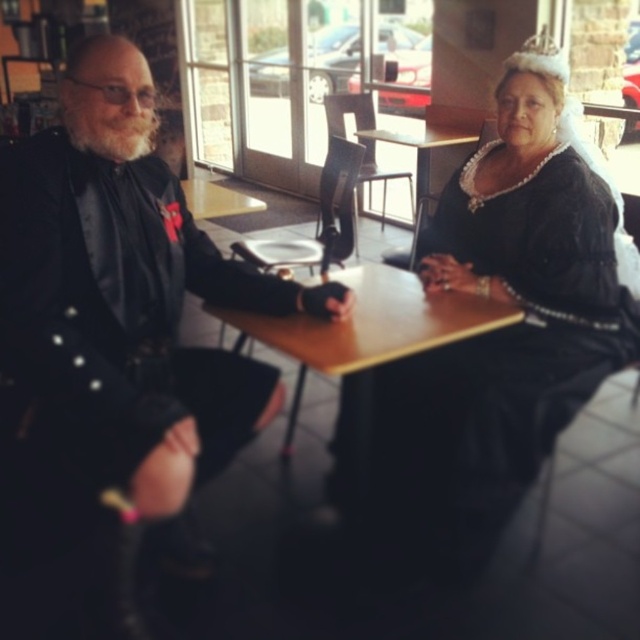
Find the location of a particular element. The width and height of the screenshot is (640, 640). black satin suit at left is located at coordinates (113, 356).

Who is positioned more to the left, black satin suit at left or black satin dress at center?

Positioned to the left is black satin suit at left.

Which is behind, point (198, 268) or point (410, 371)?

Point (410, 371)

You are a GUI agent. You are given a task and a screenshot of the screen. Output one action in this format:
    pyautogui.click(x=<x>, y=<y>)
    Task: Click on the black satin suit at left
    The width and height of the screenshot is (640, 640).
    Given the screenshot: What is the action you would take?
    pyautogui.click(x=113, y=356)

Who is positioned more to the right, black satin dress at center or wooden table at center?

black satin dress at center

Can you confirm if black satin dress at center is positioned above wooden table at center?

Actually, black satin dress at center is below wooden table at center.

Who is more distant from viewer, [442,465] or [426,330]?

Positioned behind is point [442,465].

Locate an element on the screen. The width and height of the screenshot is (640, 640). black satin dress at center is located at coordinates (506, 330).

Which is behind, point (76, 163) or point (352, 266)?

Point (352, 266)

Can you confirm if black satin suit at left is bigger than wooden table at center?

Correct, black satin suit at left is larger in size than wooden table at center.

The width and height of the screenshot is (640, 640). In order to click on black satin suit at left in this screenshot , I will do `click(113, 356)`.

Find the location of a particular element. This screenshot has width=640, height=640. black satin suit at left is located at coordinates (113, 356).